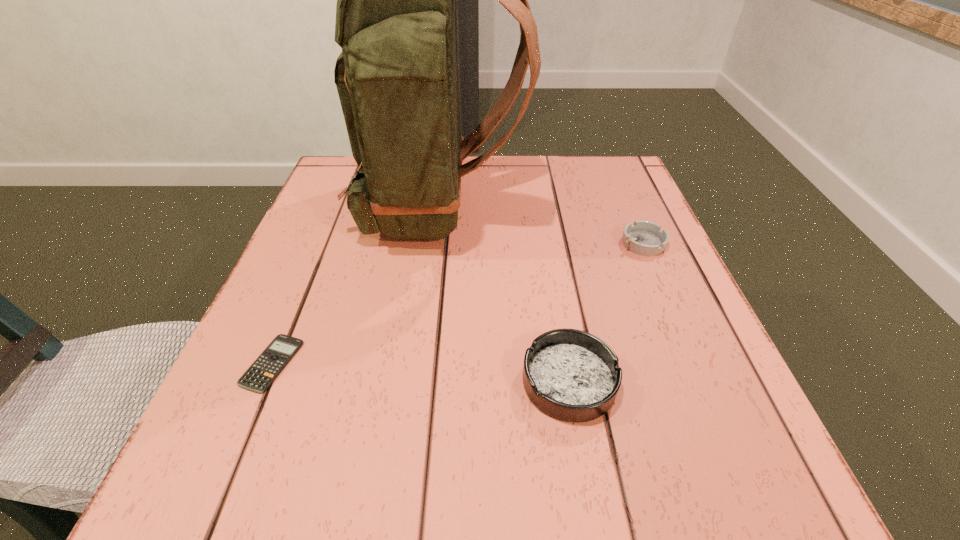
You are a GUI agent. You are given a task and a screenshot of the screen. Output one action in this format:
    pyautogui.click(x=<x>, y=<y>)
    Task: Click on the free location located on the right of the calculator
    
    Given the screenshot: What is the action you would take?
    pyautogui.click(x=394, y=363)

Identify the location of object that is at the far edge. The height and width of the screenshot is (540, 960). (398, 76).

You are a GUI agent. You are given a task and a screenshot of the screen. Output one action in this format:
    pyautogui.click(x=<x>, y=<y>)
    Task: Click on the backpack that is positioned at the left edge
    
    Given the screenshot: What is the action you would take?
    pyautogui.click(x=398, y=76)

Image resolution: width=960 pixels, height=540 pixels. I want to click on calculator at the left edge, so click(x=260, y=375).

Find the location of a particular element. object that is at the right edge is located at coordinates (645, 238).

The height and width of the screenshot is (540, 960). Identify the location of object that is positioned at the far left corner. (398, 76).

Identify the location of free space at the far edge of the desktop. This screenshot has width=960, height=540. (556, 166).

Locate an element on the screen. The image size is (960, 540). free space at the left edge of the desktop is located at coordinates (234, 436).

The image size is (960, 540). What are the coordinates of `vacant region at the right edge` in the screenshot? It's located at (660, 370).

Find the location of `free spot at the near left corner of the desktop`. free spot at the near left corner of the desktop is located at coordinates (255, 479).